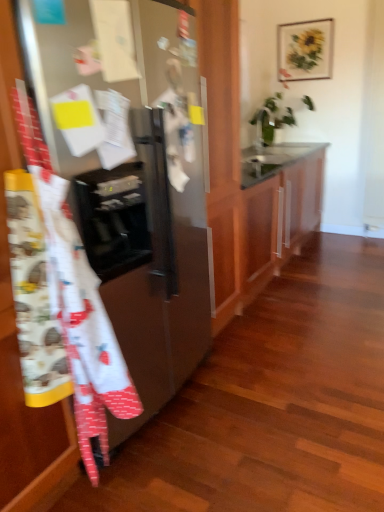
This screenshot has width=384, height=512. What do you see at coordinates (279, 204) in the screenshot?
I see `glossy wood cabinet at center` at bounding box center [279, 204].

Locate an element on the screen. white glossy sink at upper center is located at coordinates (269, 135).

I want to click on white cotton apron at left, so click(67, 307).

Locate an element on the screen. The image size is (384, 512). satin silver refrigerator at left is located at coordinates (132, 151).

Is point (49, 283) positioned in front of point (268, 160)?

Yes, point (49, 283) is in front of point (268, 160).

From the image's perspective, is white cotton apron at left positioned above or below white glossy sink at upper center?

Based on their image positions, white cotton apron at left is located beneath white glossy sink at upper center.

Based on the photo, can you confirm if white cotton apron at left is taller than white glossy sink at upper center?

Indeed, white cotton apron at left has a greater height compared to white glossy sink at upper center.

From a real-world perspective, is white cotton apron at left physically above white glossy sink at upper center?

No, from a real-world perspective, white cotton apron at left is not on top of white glossy sink at upper center.

Is the surface of glossy wood cabinet at center in direct contact with white cotton apron at left?

No, glossy wood cabinet at center is not making contact with white cotton apron at left.

Considering the relative sizes of glossy wood cabinet at center and white cotton apron at left in the image provided, is glossy wood cabinet at center wider than white cotton apron at left?

Yes.

In the scene shown: Measure the distance between glossy wood cabinet at center and white cotton apron at left.

They are 1.94 meters apart.

Considering the relative sizes of glossy wood cabinet at center and white cotton apron at left in the image provided, is glossy wood cabinet at center taller than white cotton apron at left?

In fact, glossy wood cabinet at center may be shorter than white cotton apron at left.

Who is smaller, satin silver refrigerator at left or white glossy sink at upper center?

white glossy sink at upper center is smaller.

Does satin silver refrigerator at left appear on the left side of white glossy sink at upper center?

Indeed, satin silver refrigerator at left is positioned on the left side of white glossy sink at upper center.

Is satin silver refrigerator at left looking in the opposite direction of white glossy sink at upper center?

No.

Considering the positions of point (66, 166) and point (278, 94), is point (66, 166) closer or farther from the camera than point (278, 94)?

Point (66, 166) appears to be closer to the viewer than point (278, 94).

Is white glossy sink at upper center aimed at glossy wood cabinet at center?

No.

How different are the orientations of white glossy sink at upper center and glossy wood cabinet at center in degrees?

There is a 0.324-degree angle between the facing directions of white glossy sink at upper center and glossy wood cabinet at center.

Between point (286, 110) and point (252, 221), which one is positioned in front?

The point (252, 221) is in front.

Considering the positions of objects white glossy sink at upper center and glossy wood cabinet at center in the image provided, who is more to the right, white glossy sink at upper center or glossy wood cabinet at center?

white glossy sink at upper center.

Considering the relative positions of satin silver refrigerator at left and white cotton apron at left in the image provided, is satin silver refrigerator at left to the left of white cotton apron at left from the viewer's perspective?

Correct, you'll find satin silver refrigerator at left to the left of white cotton apron at left.

Which object is closer to the camera taking this photo, satin silver refrigerator at left or white cotton apron at left?

white cotton apron at left.

From the image's perspective, does satin silver refrigerator at left appear higher than white cotton apron at left?

Indeed, from the image's perspective, satin silver refrigerator at left is shown above white cotton apron at left.

Looking at this image, considering the relative sizes of satin silver refrigerator at left and white cotton apron at left in the image provided, is satin silver refrigerator at left shorter than white cotton apron at left?

No.

Is white cotton apron at left taller or shorter than glossy wood cabinet at center?

white cotton apron at left is taller than glossy wood cabinet at center.

Considering the relative sizes of white cotton apron at left and glossy wood cabinet at center in the image provided, is white cotton apron at left thinner than glossy wood cabinet at center?

Yes.

Which is closer to the camera, (40, 186) or (254, 212)?

The point (40, 186) is more forward.

Is white cotton apron at left inside or outside of glossy wood cabinet at center?

white cotton apron at left lies outside glossy wood cabinet at center.

Between point (268, 248) and point (294, 122), which one is positioned behind?

The point (294, 122) is farther from the camera.

Considering the relative sizes of glossy wood cabinet at center and white glossy sink at upper center in the image provided, is glossy wood cabinet at center wider than white glossy sink at upper center?

Yes, glossy wood cabinet at center is wider than white glossy sink at upper center.

Looking at this image, is glossy wood cabinet at center facing towards white glossy sink at upper center?

No, glossy wood cabinet at center is not facing towards white glossy sink at upper center.

Who is taller, glossy wood cabinet at center or white glossy sink at upper center?

With more height is glossy wood cabinet at center.

Identify the location of sink behind the white cotton apron at left. Image resolution: width=384 pixels, height=512 pixels. (269, 135).

The width and height of the screenshot is (384, 512). I want to click on blanket below the glossy wood cabinet at center (from the image's perspective), so click(x=67, y=307).

Which object lies further to the anchor point white cotton apron at left, glossy wood cabinet at center or white glossy sink at upper center?

white glossy sink at upper center is positioned further to the anchor white cotton apron at left.

Looking at the image, which one is located further to white glossy sink at upper center, glossy wood cabinet at center or white cotton apron at left?

The object further to white glossy sink at upper center is white cotton apron at left.

Estimate the real-world distances between objects in this image. Which object is closer to white glossy sink at upper center, satin silver refrigerator at left or white cotton apron at left?

satin silver refrigerator at left is positioned closer to the anchor white glossy sink at upper center.

Consider the image. Based on their spatial positions, is white cotton apron at left or white glossy sink at upper center further from satin silver refrigerator at left?

Among the two, white glossy sink at upper center is located further to satin silver refrigerator at left.

Based on their spatial positions, is glossy wood cabinet at center or satin silver refrigerator at left further from white cotton apron at left?

glossy wood cabinet at center.

When comparing their distances from satin silver refrigerator at left, does glossy wood cabinet at center or white cotton apron at left seem further?

glossy wood cabinet at center lies further to satin silver refrigerator at left than the other object.

Looking at the image, which one is located further to white glossy sink at upper center, white cotton apron at left or glossy wood cabinet at center?

white cotton apron at left.

Considering their positions, is satin silver refrigerator at left positioned further to white glossy sink at upper center than glossy wood cabinet at center?

satin silver refrigerator at left lies further to white glossy sink at upper center than the other object.

The image size is (384, 512). Find the location of `cabinetry positioned between white cotton apron at left and white glossy sink at upper center from near to far`. cabinetry positioned between white cotton apron at left and white glossy sink at upper center from near to far is located at coordinates (279, 204).

Where is `refrigerator located between white cotton apron at left and white glossy sink at upper center in the depth direction`? This screenshot has width=384, height=512. refrigerator located between white cotton apron at left and white glossy sink at upper center in the depth direction is located at coordinates (132, 151).

Find the location of `refrigerator positioned between white cotton apron at left and glossy wood cabinet at center from near to far`. refrigerator positioned between white cotton apron at left and glossy wood cabinet at center from near to far is located at coordinates (132, 151).

This screenshot has width=384, height=512. I want to click on cabinetry between satin silver refrigerator at left and white glossy sink at upper center in the front-back direction, so click(279, 204).